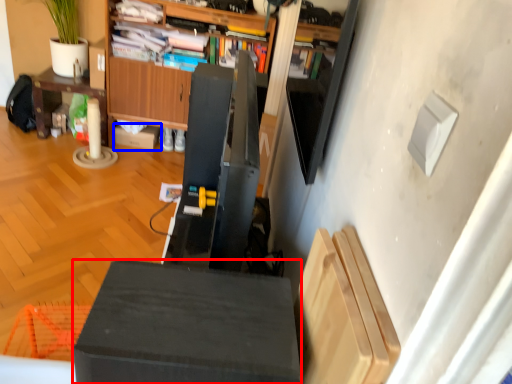
Question: Which object appears closest to the camera in this image, furniture (highlighted by a red box) or cardboard box (highlighted by a blue box)?

Choices:
 (A) furniture
 (B) cardboard box

Answer: (A)